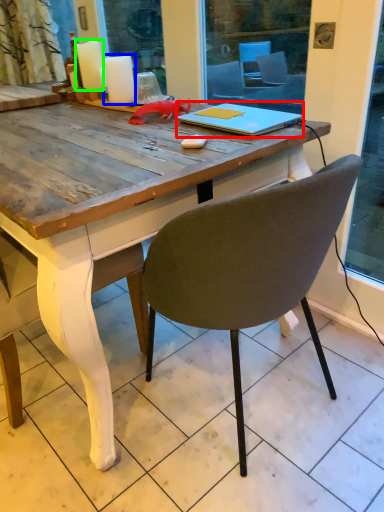
Question: Which object is positioned closest to notebook (highlighted by a red box)? Select from candle (highlighted by a blue box) and candle (highlighted by a green box).

Choices:
 (A) candle
 (B) candle

Answer: (A)